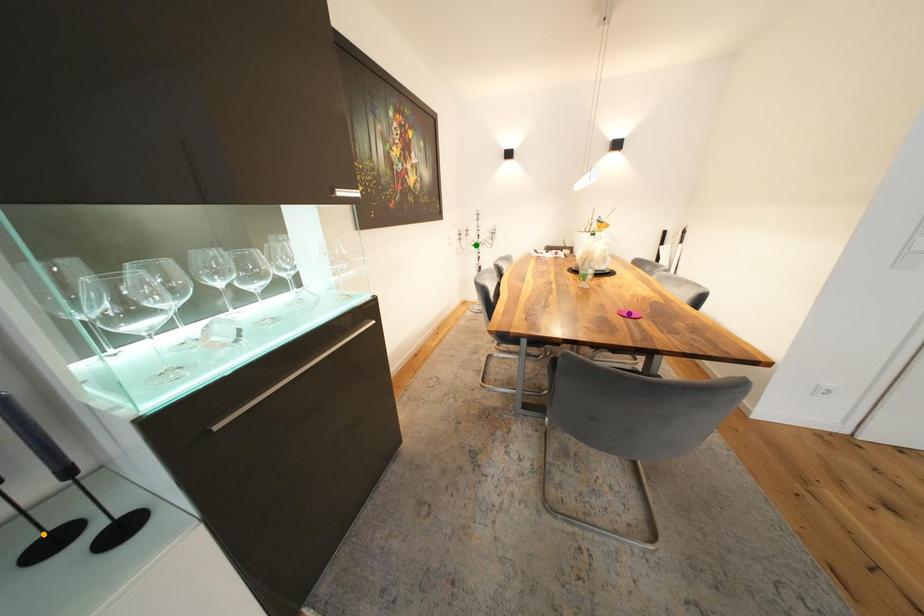
Based on the photo, order these from nearest to farthest:
purple point
orange point
green point

orange point → purple point → green point